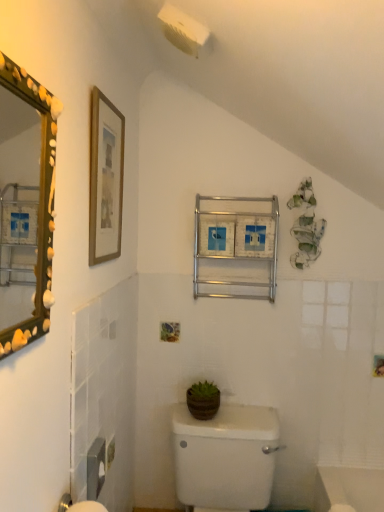
Question: Is metallic silver medicine cabinet at center positioned in front of white glossy toilet at center?

Choices:
 (A) no
 (B) yes

Answer: (A)

Question: From a real-world perspective, is metallic silver medicine cabinet at center below white glossy toilet at center?

Choices:
 (A) yes
 (B) no

Answer: (B)

Question: Can you confirm if metallic silver medicine cabinet at center is taller than white glossy toilet at center?

Choices:
 (A) yes
 (B) no

Answer: (B)

Question: Is metallic silver medicine cabinet at center positioned beyond the bounds of white glossy toilet at center?

Choices:
 (A) no
 (B) yes

Answer: (B)

Question: Does metallic silver medicine cabinet at center turn towards white glossy toilet at center?

Choices:
 (A) yes
 (B) no

Answer: (B)

Question: Does metallic silver medicine cabinet at center have a greater width compared to white glossy toilet at center?

Choices:
 (A) yes
 (B) no

Answer: (B)

Question: Is wooden framed print at upper left positioned in front of white glossy toilet at center?

Choices:
 (A) yes
 (B) no

Answer: (A)

Question: Can you confirm if wooden framed print at upper left is smaller than white glossy toilet at center?

Choices:
 (A) yes
 (B) no

Answer: (A)

Question: Is wooden framed print at upper left further to camera compared to white glossy toilet at center?

Choices:
 (A) yes
 (B) no

Answer: (B)

Question: Does wooden framed print at upper left have a greater width compared to white glossy toilet at center?

Choices:
 (A) no
 (B) yes

Answer: (A)

Question: From a real-world perspective, is wooden framed print at upper left located higher than white glossy toilet at center?

Choices:
 (A) yes
 (B) no

Answer: (A)

Question: Does wooden framed print at upper left appear on the left side of white glossy toilet at center?

Choices:
 (A) yes
 (B) no

Answer: (A)

Question: Considering the relative sizes of wooden framed print at upper left and green matte pot at center in the image provided, is wooden framed print at upper left wider than green matte pot at center?

Choices:
 (A) yes
 (B) no

Answer: (B)